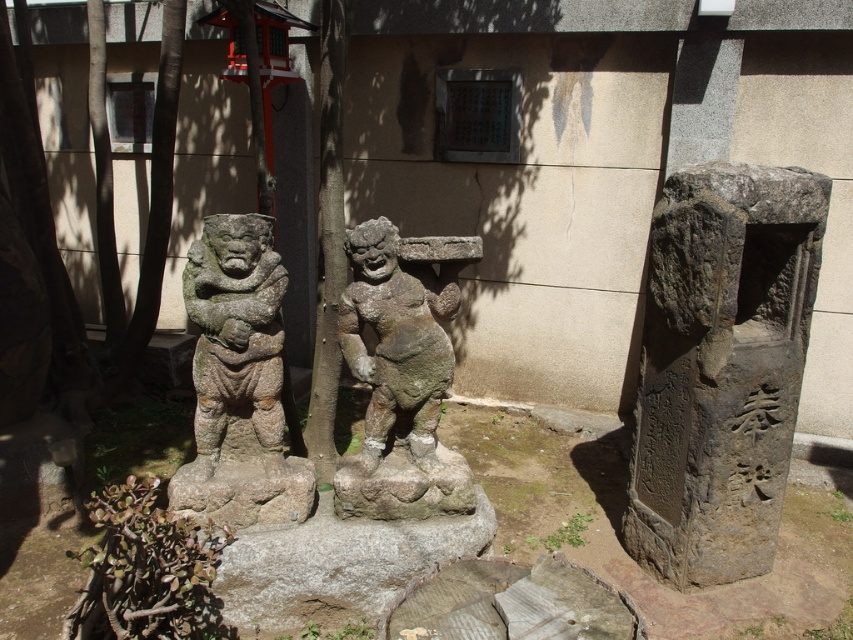
I want to click on gray stone statue at center, so click(x=398, y=381).

Who is lower down, gray stone statue at center or granite statue at left?

gray stone statue at center

Is point (438, 461) positioned after point (248, 310)?

Yes, point (438, 461) is farther from viewer.

I want to click on gray stone statue at center, so click(398, 381).

Between gray stone pillar at right and granite statue at left, which one is positioned lower?

Positioned lower is gray stone pillar at right.

Can you confirm if gray stone pillar at right is positioned to the right of granite statue at left?

Correct, you'll find gray stone pillar at right to the right of granite statue at left.

What do you see at coordinates (721, 368) in the screenshot?
I see `gray stone pillar at right` at bounding box center [721, 368].

Locate an element on the screen. The width and height of the screenshot is (853, 640). gray stone pillar at right is located at coordinates (721, 368).

Between gray stone pillar at right and gray stone statue at center, which one appears on the right side from the viewer's perspective?

gray stone pillar at right

Is gray stone pillar at right shorter than gray stone statue at center?

In fact, gray stone pillar at right may be taller than gray stone statue at center.

Does point (666, 300) lie in front of point (467, 252)?

No, it is not.

Where is `gray stone pillar at right`? This screenshot has height=640, width=853. gray stone pillar at right is located at coordinates (721, 368).